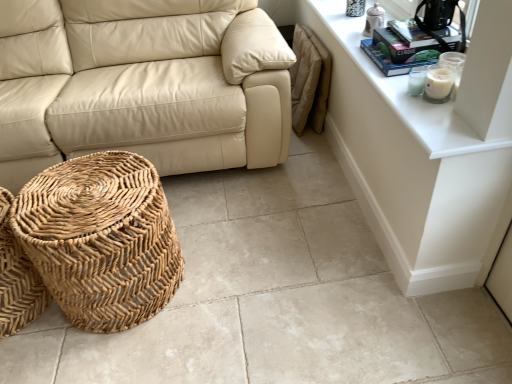
Find the location of a particular element. white glossy dresser at upper right is located at coordinates (423, 152).

What is the approximate height of hardcover book at upper right?

hardcover book at upper right is 2.11 inches tall.

The height and width of the screenshot is (384, 512). What are the coordinates of `white glossy dresser at upper right` in the screenshot? It's located at (423, 152).

Is white glass candle at upper right not within white glossy dresser at upper right?

Absolutely, white glass candle at upper right is external to white glossy dresser at upper right.

Which object is further away from the camera taking this photo, white glass candle at upper right or white glossy dresser at upper right?

white glass candle at upper right is behind.

Is white glass candle at upper right in contact with white glossy dresser at upper right?

No, white glass candle at upper right is not in contact with white glossy dresser at upper right.

From a real-world perspective, relative to white glossy dresser at upper right, is white glass candle at upper right vertically above or below?

In terms of real-world spatial position, white glass candle at upper right is above white glossy dresser at upper right.

Does beige leather couch at center turn towards white glass candle at upper right?

No, beige leather couch at center is not oriented towards white glass candle at upper right.

Which is nearer, (134, 104) or (441, 95)?

Point (134, 104) is farther from the camera than point (441, 95).

Which of these two, beige leather couch at center or white glass candle at upper right, stands shorter?

white glass candle at upper right.

Is beige leather couch at center with white glass candle at upper right?

No, beige leather couch at center is not touching white glass candle at upper right.

From a real-world perspective, is white glass candle at upper right physically above hardcover book at upper right?

No, from a real-world perspective, white glass candle at upper right is not over hardcover book at upper right

Considering the positions of point (426, 82) and point (453, 29), is point (426, 82) closer or farther from the camera than point (453, 29)?

Clearly, point (426, 82) is closer to the camera than point (453, 29).

Which of these two, white glass candle at upper right or hardcover book at upper right, stands taller?

Standing taller between the two is white glass candle at upper right.

Considering their positions, is woven natural basket at lower left, acting as the second basket starting from the right, located in front of or behind beige leather couch at center?

In the image, woven natural basket at lower left, acting as the second basket starting from the right, appears in front of beige leather couch at center.

Is woven natural basket at lower left, acting as the 1th basket starting from the left, to the left of beige leather couch at center from the viewer's perspective?

Yes, woven natural basket at lower left, acting as the 1th basket starting from the left, is to the left of beige leather couch at center.

Is woven natural basket at lower left, acting as the 1th basket starting from the left, not within beige leather couch at center?

Absolutely, woven natural basket at lower left, acting as the 1th basket starting from the left, is external to beige leather couch at center.

How far apart are woven natural basket at lower left, acting as the second basket starting from the right, and beige leather couch at center?

They are 31.29 inches apart.

Between point (147, 137) and point (306, 1), which one is positioned in front?

Point (147, 137)

From the image's perspective, which is above, beige leather couch at center or white glossy dresser at upper right?

beige leather couch at center is shown above in the image.

What's the angular difference between beige leather couch at center and white glossy dresser at upper right's facing directions?

91.2 degrees.

Which of these two, beige leather couch at center or white glossy dresser at upper right, is wider?

With larger width is beige leather couch at center.

From the image's perspective, who appears lower, hardcover book at upper right or natural woven basket at lower left, which is the 2th basket from left to right?

natural woven basket at lower left, which is the 2th basket from left to right.

How many degrees apart are the facing directions of hardcover book at upper right and natural woven basket at lower left, which is the 2th basket from left to right?

91.4 degrees.

Can you confirm if hardcover book at upper right is bigger than natural woven basket at lower left, the 1th basket positioned from the right?

No, hardcover book at upper right is not bigger than natural woven basket at lower left, the 1th basket positioned from the right.

Is hardcover book at upper right placed right next to natural woven basket at lower left, the 1th basket positioned from the right?

hardcover book at upper right and natural woven basket at lower left, the 1th basket positioned from the right, are not in contact.

Considering the relative positions of natural woven basket at lower left, the 1th basket positioned from the right, and white glass candle at upper right in the image provided, is natural woven basket at lower left, the 1th basket positioned from the right, to the left or to the right of white glass candle at upper right?

natural woven basket at lower left, the 1th basket positioned from the right, is to the left of white glass candle at upper right.

From the image's perspective, between natural woven basket at lower left, which is the 2th basket from left to right, and white glass candle at upper right, which one is located above?

white glass candle at upper right appears higher in the image.

Which of these two, natural woven basket at lower left, which is the 2th basket from left to right, or white glass candle at upper right, is smaller?

With smaller size is white glass candle at upper right.

Does natural woven basket at lower left, which is the 2th basket from left to right, have a lesser height compared to white glass candle at upper right?

In fact, natural woven basket at lower left, which is the 2th basket from left to right, may be taller than white glass candle at upper right.

Identify the location of dresser in front of the white glass candle at upper right. (423, 152).

You are a GUI agent. You are given a task and a screenshot of the screen. Output one action in this format:
    pyautogui.click(x=<x>, y=<y>)
    Task: Click on the studio couch to the left of white glass candle at upper right
    
    Given the screenshot: What is the action you would take?
    pyautogui.click(x=141, y=84)

When comparing their distances from natural woven basket at lower left, the 1th basket positioned from the right, does white glossy dresser at upper right or white glass candle at upper right seem further?

Among the two, white glass candle at upper right is located further to natural woven basket at lower left, the 1th basket positioned from the right.

Which object lies further to the anchor point beige leather couch at center, white glass candle at upper right or natural woven basket at lower left, which is the 2th basket from left to right?

The object further to beige leather couch at center is white glass candle at upper right.

When comparing their distances from white glass candle at upper right, does woven natural basket at lower left, acting as the 1th basket starting from the left, or hardcover book at upper right seem closer?

The object closer to white glass candle at upper right is hardcover book at upper right.

Considering their positions, is beige leather couch at center positioned further to natural woven basket at lower left, the 1th basket positioned from the right, than white glass candle at upper right?

white glass candle at upper right is further to natural woven basket at lower left, the 1th basket positioned from the right.

From the image, which object appears to be nearer to beige leather couch at center, woven natural basket at lower left, acting as the second basket starting from the right, or natural woven basket at lower left, the 1th basket positioned from the right?

natural woven basket at lower left, the 1th basket positioned from the right, is closer to beige leather couch at center.

Which object lies further to the anchor point hardcover book at upper right, natural woven basket at lower left, the 1th basket positioned from the right, or white glass candle at upper right?

natural woven basket at lower left, the 1th basket positioned from the right, is further to hardcover book at upper right.

Estimate the real-world distances between objects in this image. Which object is further from beige leather couch at center, white glass candle at upper right or hardcover book at upper right?

white glass candle at upper right is positioned further to the anchor beige leather couch at center.

Considering their positions, is white glossy dresser at upper right positioned further to hardcover book at upper right than woven natural basket at lower left, acting as the 1th basket starting from the left?

woven natural basket at lower left, acting as the 1th basket starting from the left, lies further to hardcover book at upper right than the other object.

Where is `dresser between woven natural basket at lower left, acting as the second basket starting from the right, and hardcover book at upper right from left to right`? dresser between woven natural basket at lower left, acting as the second basket starting from the right, and hardcover book at upper right from left to right is located at coordinates (423, 152).

The height and width of the screenshot is (384, 512). In order to click on candle between white glossy dresser at upper right and hardcover book at upper right along the z-axis in this screenshot , I will do `click(438, 85)`.

At what (x,y) coordinates should I click in order to perform the action: click on basket between woven natural basket at lower left, acting as the second basket starting from the right, and hardcover book at upper right. Please return your answer as a coordinate pair (x, y). The width and height of the screenshot is (512, 384). Looking at the image, I should click on (101, 239).

This screenshot has width=512, height=384. In order to click on dresser between natural woven basket at lower left, which is the 2th basket from left to right, and hardcover book at upper right, in the horizontal direction in this screenshot , I will do `click(423, 152)`.